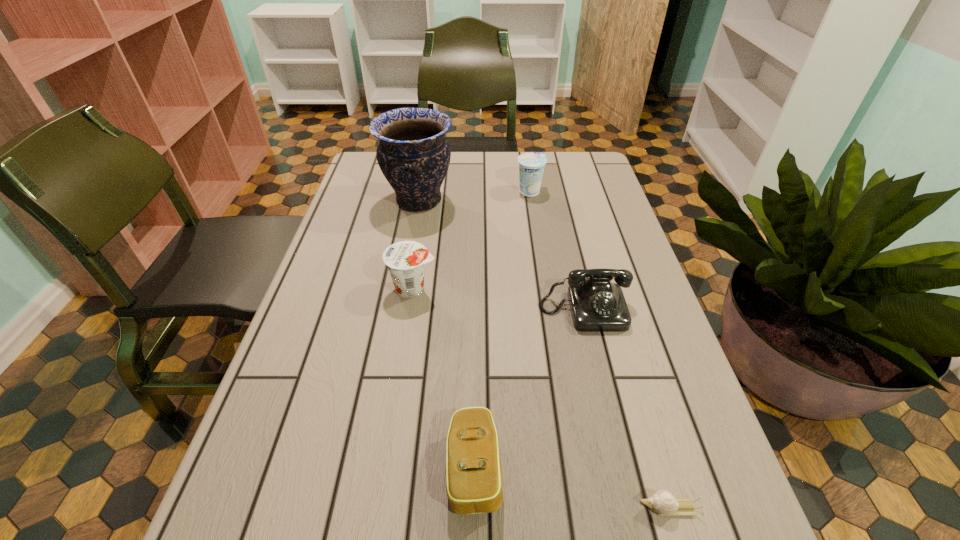
Locate an element on the screen. This screenshot has height=540, width=960. vacant space located 0.170m on the dial of the telephone is located at coordinates (606, 403).

This screenshot has height=540, width=960. I want to click on vacant space situated 0.290m on the zipper side of the second shortest object, so click(676, 468).

Identify the location of vacant space located on the shell of the escargot. (514, 508).

This screenshot has width=960, height=540. Identify the location of vacant position located on the shell of the escargot. (507, 508).

Identify the location of vacant space located on the shell of the escargot. The height and width of the screenshot is (540, 960). (481, 508).

Image resolution: width=960 pixels, height=540 pixels. I want to click on pottery that is at the far edge, so click(x=413, y=154).

Where is `yogurt at the far edge`? The image size is (960, 540). yogurt at the far edge is located at coordinates (531, 165).

Where is `object situated at the left edge`? Image resolution: width=960 pixels, height=540 pixels. object situated at the left edge is located at coordinates (413, 154).

The height and width of the screenshot is (540, 960). Identify the location of telephone that is at the right edge. (597, 305).

I want to click on escargot that is positioned at the right edge, so click(662, 502).